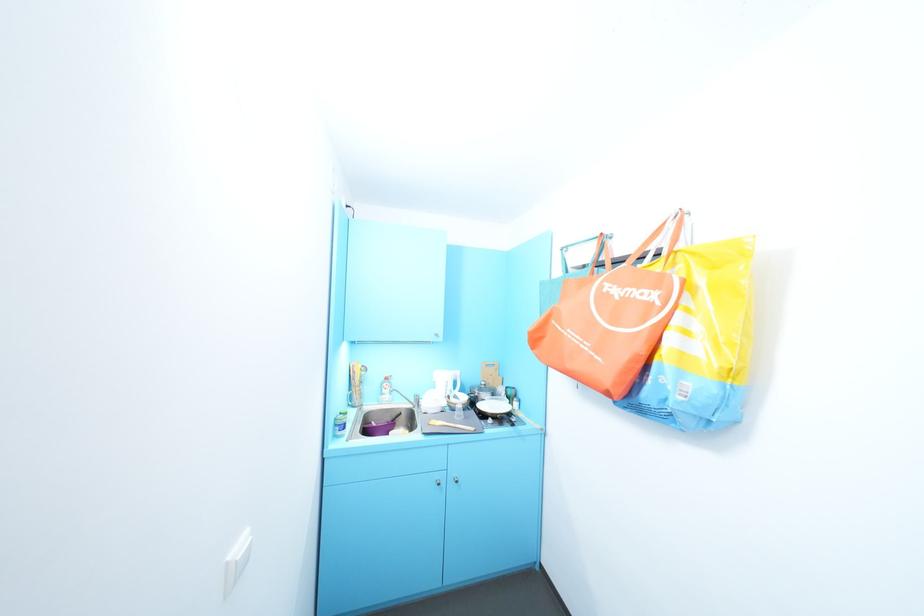
Where is `silver cabinet handle`? The height and width of the screenshot is (616, 924). silver cabinet handle is located at coordinates (438, 482).